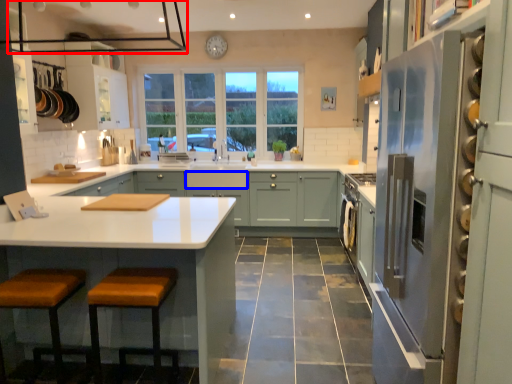
Question: Which of the following is the closest to the observer, exhaust hood (highlighted by a red box) or drawer (highlighted by a blue box)?

Choices:
 (A) exhaust hood
 (B) drawer

Answer: (A)